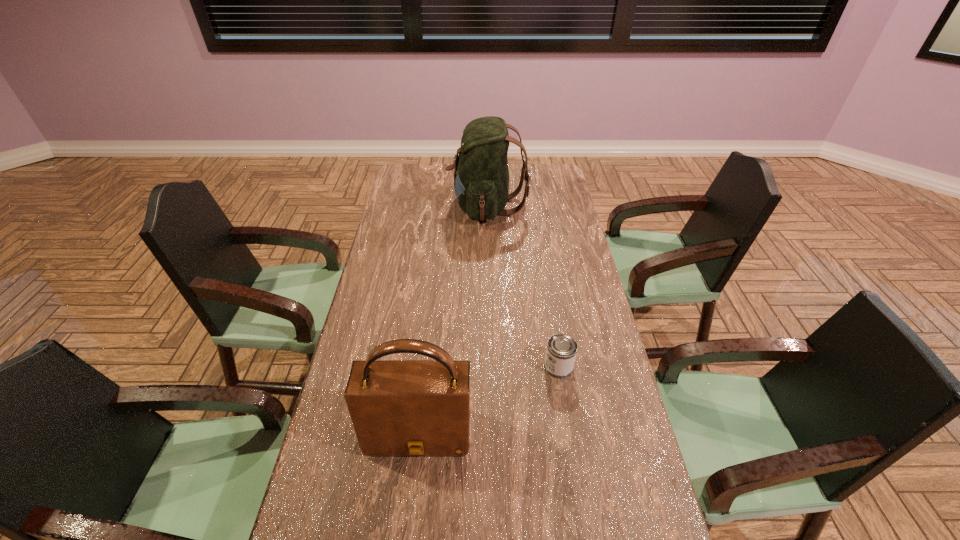
Where is `object positioned at the left edge`? The image size is (960, 540). object positioned at the left edge is located at coordinates (398, 407).

Image resolution: width=960 pixels, height=540 pixels. Find the location of `object at the right edge`. object at the right edge is located at coordinates (561, 351).

At what (x,y) coordinates should I click in order to perform the action: click on vacant area at the left edge. Please return your answer as a coordinate pair (x, y). The width and height of the screenshot is (960, 540). Looking at the image, I should click on (406, 207).

The image size is (960, 540). What are the coordinates of `vacant space in between the can and the backpack` in the screenshot? It's located at (523, 287).

I want to click on free spot between the nearest object and the second farthest object, so click(489, 400).

Locate an element on the screen. The width and height of the screenshot is (960, 540). free space that is in between the shoulder bag and the backpack is located at coordinates (453, 320).

This screenshot has height=540, width=960. I want to click on vacant area that lies between the shoulder bag and the shortest object, so click(489, 400).

Where is `free space between the can and the farthest object`? The width and height of the screenshot is (960, 540). free space between the can and the farthest object is located at coordinates (523, 287).

Find the location of a particular element. The image size is (960, 540). free space between the farthest object and the can is located at coordinates (523, 287).

Find the location of a particular element. the closest object to the farthest object is located at coordinates (561, 351).